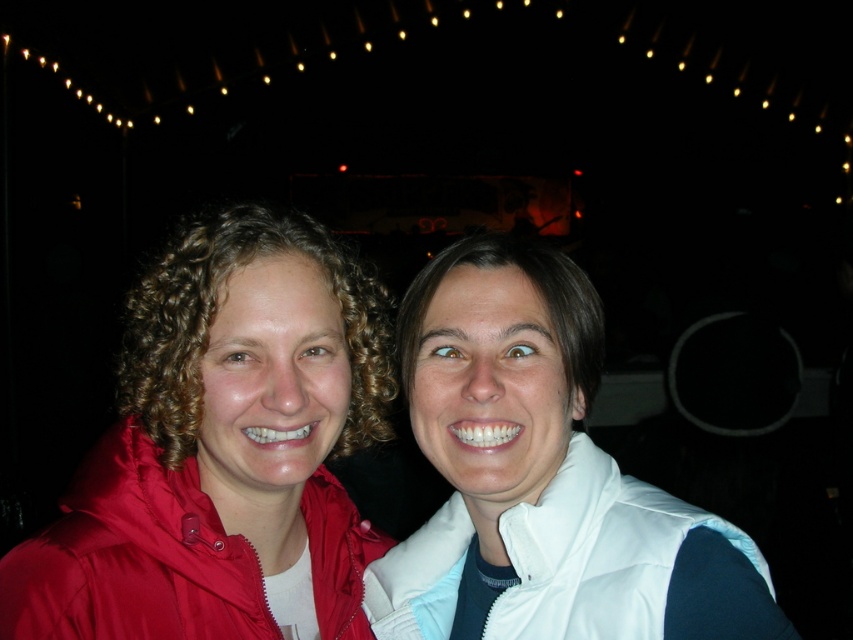
Looking at this image, does matte red jacket at left have a larger size compared to white puffy vest at lower right?

Correct, matte red jacket at left is larger in size than white puffy vest at lower right.

Looking at this image, who is shorter, matte red jacket at left or white puffy vest at lower right?

white puffy vest at lower right

Is point (286, 292) behind point (448, 598)?

No, (286, 292) is closer to viewer.

You are a GUI agent. You are given a task and a screenshot of the screen. Output one action in this format:
    pyautogui.click(x=<x>, y=<y>)
    Task: Click on the matte red jacket at left
    
    Given the screenshot: What is the action you would take?
    pyautogui.click(x=219, y=445)